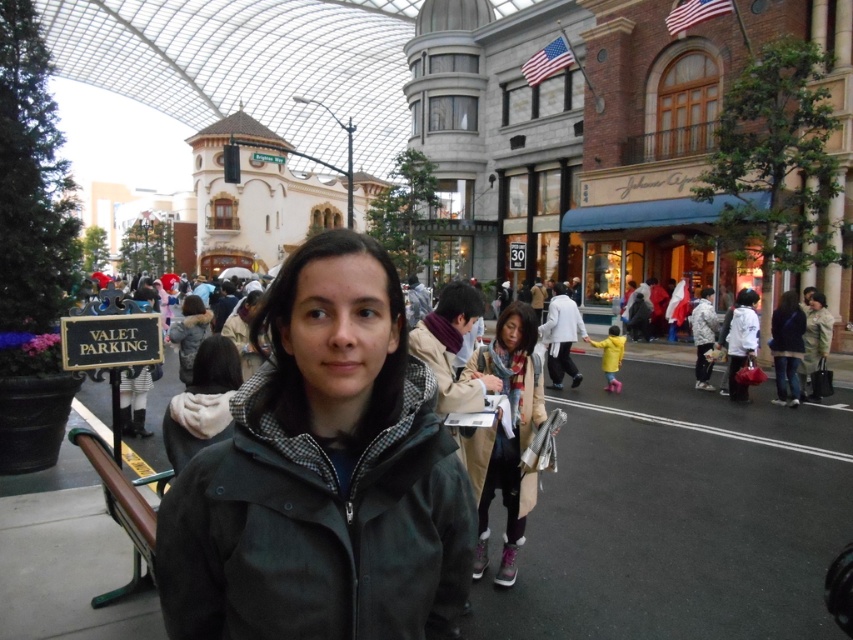
Based on the photo, you are a photographer trying to capture both the light brown fur coat at center and the matte black jacket at right in the same frame. Which object should you focus on first to ensure both are in the shot?

You should focus on the light brown fur coat at center first since it is in front of the matte black jacket at right, allowing both to be captured in the frame.

You are a delivery person trying to locate the valet parking bench. You see a matte black jacket at right and a light gray fabric coat at center. Which direction should you walk to reach the bench labeled VALET PARKING?

The matte black jacket at right is to the right of the light gray fabric coat at center. Since the bench is near the person in the dark green jacket, you should look for the dark green jacket first, then move towards the bench labeled VALET PARKING. The direction depends on your current position relative to these jackets.

Looking at this image, you are a fashion designer observing the crowd in the urban scene. You notice a matte black jacket at right and a light gray fabric coat at center. Which clothing item has a greater height measurement?

The matte black jacket at right is taller than the light gray fabric coat at center according to the description.